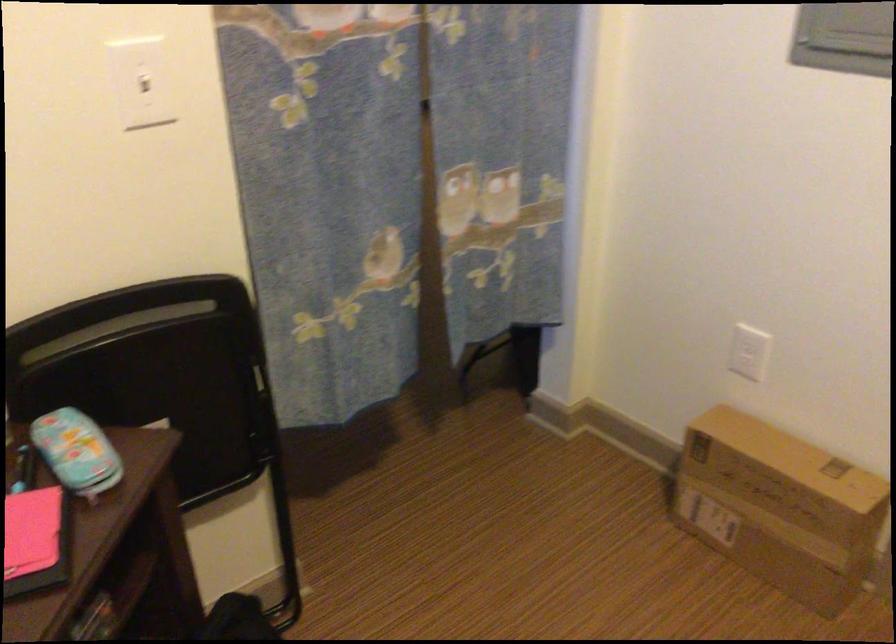
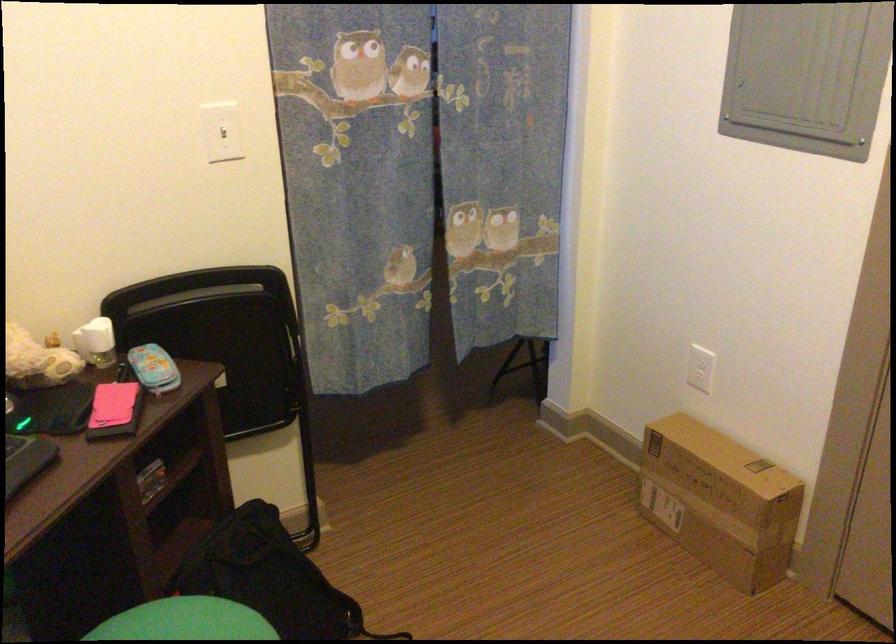
Find the pixel in the second image that matches pixel 153 88 in the first image.

(222, 131)